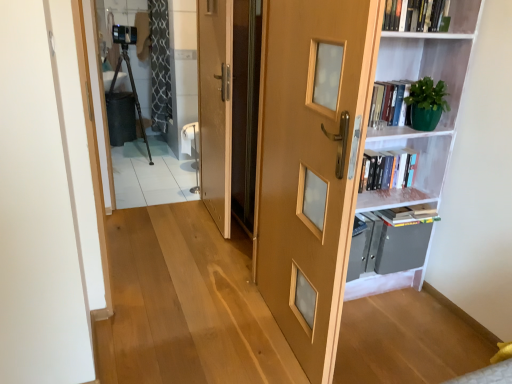
Identify the location of light brown wooden door at center, positioned as the first door in front-to-back order. The height and width of the screenshot is (384, 512). (311, 164).

The height and width of the screenshot is (384, 512). What do you see at coordinates (245, 108) in the screenshot?
I see `transparent glass screen door at center` at bounding box center [245, 108].

The height and width of the screenshot is (384, 512). Describe the element at coordinates (406, 94) in the screenshot. I see `white matte bookshelf at right` at that location.

Find the location of a particular element. The image size is (512, 384). wooden door at center, which ranks as the first door in back-to-front order is located at coordinates (215, 107).

Where is `light brown wooden door at center, which appears as the 1th door when viewed from the right`? light brown wooden door at center, which appears as the 1th door when viewed from the right is located at coordinates (311, 164).

Between light brown wooden door at center, which is the 2th door in left-to-right order, and transparent glass screen door at center, which one has less height?

Standing shorter between the two is light brown wooden door at center, which is the 2th door in left-to-right order.

Looking at this image, could you measure the distance between light brown wooden door at center, which appears as the 1th door when viewed from the right, and transparent glass screen door at center?

light brown wooden door at center, which appears as the 1th door when viewed from the right, and transparent glass screen door at center are 35.71 inches apart.

Can you confirm if light brown wooden door at center, which appears as the 1th door when viewed from the right, is smaller than transparent glass screen door at center?

No.

Is light brown wooden door at center, arranged as the second door when viewed from the back, further to the viewer compared to transparent glass screen door at center?

No, light brown wooden door at center, arranged as the second door when viewed from the back, is in front of transparent glass screen door at center.

Consider the image. Which object is positioned more to the left, transparent glass screen door at center or wooden door at center, which ranks as the first door in back-to-front order?

Positioned to the left is wooden door at center, which ranks as the first door in back-to-front order.

Would you say transparent glass screen door at center is outside wooden door at center, positioned as the 2th door in front-to-back order?

Absolutely, transparent glass screen door at center is external to wooden door at center, positioned as the 2th door in front-to-back order.

Is point (252, 57) closer or farther from the camera than point (210, 120)?

Point (252, 57) appears to be closer to the viewer than point (210, 120).

Considering the sizes of objects transparent glass screen door at center and wooden door at center, which ranks as the first door in back-to-front order, in the image provided, who is thinner, transparent glass screen door at center or wooden door at center, which ranks as the first door in back-to-front order,?

With smaller width is transparent glass screen door at center.

Is hardcover book at upper right, the first book positioned from the bottom, far from hardcover book at upper right, the 1th book positioned from the top?

hardcover book at upper right, the first book positioned from the bottom, is near hardcover book at upper right, the 1th book positioned from the top, not far away.

Would you say hardcover book at upper right, arranged as the 1th book when viewed from the back, contains hardcover book at upper right, which appears as the 2th book when viewed from the back?

Definitely not — hardcover book at upper right, which appears as the 2th book when viewed from the back, is not inside hardcover book at upper right, arranged as the 1th book when viewed from the back.

Does point (368, 170) come in front of point (416, 5)?

No.

Between hardcover book at upper right, placed as the second book when sorted from front to back, and hardcover book at upper right, the first book positioned from the front, which one has smaller width?

hardcover book at upper right, the first book positioned from the front, is thinner.

From the picture: Is light brown wooden door at center, which is the 2th door in left-to-right order, next to black textured curtain at upper left?

No, light brown wooden door at center, which is the 2th door in left-to-right order, is not with black textured curtain at upper left.

In order to click on door that is the 2nd object directly below the black textured curtain at upper left (from a real-world perspective) in this screenshot , I will do `click(311, 164)`.

Is black textured curtain at upper left a part of light brown wooden door at center, arranged as the second door when viewed from the back?

No, light brown wooden door at center, arranged as the second door when viewed from the back, does not contain black textured curtain at upper left.

Based on the photo, relative to black textured curtain at upper left, is light brown wooden door at center, arranged as the second door when viewed from the back, in front or behind?

light brown wooden door at center, arranged as the second door when viewed from the back, is in front of black textured curtain at upper left.

From the image's perspective, which one is positioned higher, hardcover book at upper right, the second book ordered from the bottom, or wooden door at center, the first door viewed from the left?

→ hardcover book at upper right, the second book ordered from the bottom, appears higher in the image.

Who is bigger, hardcover book at upper right, the second book ordered from the bottom, or wooden door at center, positioned as the 2th door in front-to-back order?

With larger size is wooden door at center, positioned as the 2th door in front-to-back order.

Does point (425, 25) come in front of point (203, 158)?

Yes, point (425, 25) is closer to viewer.

Based on the photo, can you confirm if light brown wooden door at center, arranged as the second door when viewed from the back, is shorter than white matte bookshelf at right?

Yes, light brown wooden door at center, arranged as the second door when viewed from the back, is shorter than white matte bookshelf at right.

Which of these two, light brown wooden door at center, which appears as the 1th door when viewed from the right, or white matte bookshelf at right, is thinner?

Thinner between the two is light brown wooden door at center, which appears as the 1th door when viewed from the right.

Is point (371, 15) positioned before point (384, 34)?

Yes.

From the picture: How much distance is there between black textured curtain at upper left and hardcover book at upper right, placed as the second book when sorted from front to back?

9.59 feet.

From a real-world perspective, is black textured curtain at upper left below hardcover book at upper right, arranged as the 1th book when viewed from the back?

No, from a real-world perspective, black textured curtain at upper left is not beneath hardcover book at upper right, arranged as the 1th book when viewed from the back.

Considering the sizes of objects black textured curtain at upper left and hardcover book at upper right, placed as the second book when sorted from front to back, in the image provided, who is shorter, black textured curtain at upper left or hardcover book at upper right, placed as the second book when sorted from front to back,?

hardcover book at upper right, placed as the second book when sorted from front to back, is shorter.

Can you confirm if black textured curtain at upper left is bigger than hardcover book at upper right, placed as the second book when sorted from front to back?

Yes.

This screenshot has width=512, height=384. Identify the location of the 2nd door positioned below the transparent glass screen door at center (from a real-world perspective). (311, 164).

Locate an element on the screen. The height and width of the screenshot is (384, 512). door on the left of transparent glass screen door at center is located at coordinates (215, 107).

Considering their positions, is wooden door at center, which is the second door from right to left, positioned closer to light brown wooden door at center, positioned as the first door in front-to-back order, than metallic gray cabinet at right?

metallic gray cabinet at right.

Looking at the image, which one is located closer to hardcover book at upper right, placed as the second book when sorted from front to back, clear glass door at upper left or metallic gray cabinet at right?

Based on the image, metallic gray cabinet at right appears to be nearer to hardcover book at upper right, placed as the second book when sorted from front to back.

Considering their positions, is hardcover book at upper right, placed as the second book when sorted from front to back, positioned further to black textured curtain at upper left than metallic gray cabinet at right?

metallic gray cabinet at right.

Considering their positions, is hardcover book at upper right, the first book positioned from the front, positioned closer to transparent glass screen door at center than white matte bookshelf at right?

Based on the image, white matte bookshelf at right appears to be nearer to transparent glass screen door at center.

Considering their positions, is hardcover book at upper right, which appears as the 2th book when viewed from the back, positioned further to clear glass door at upper left than black textured curtain at upper left?

hardcover book at upper right, which appears as the 2th book when viewed from the back.

Which object lies nearer to the anchor point transparent glass screen door at center, white matte bookshelf at right or hardcover book at upper right, the first book positioned from the front?

white matte bookshelf at right.

When comparing their distances from hardcover book at upper right, positioned as the second book in top-to-bottom order, does clear glass door at upper left or light brown wooden door at center, which appears as the 1th door when viewed from the right, seem closer?

light brown wooden door at center, which appears as the 1th door when viewed from the right.

Based on their spatial positions, is metallic gray cabinet at right or clear glass door at upper left closer to black textured curtain at upper left?

clear glass door at upper left is closer to black textured curtain at upper left.

What are the coordinates of `door between metallic gray cabinet at right and black textured curtain at upper left in the front-back direction` in the screenshot? It's located at (215, 107).

This screenshot has height=384, width=512. Identify the location of screen door situated between wooden door at center, which ranks as the first door in back-to-front order, and hardcover book at upper right, arranged as the 1th book when viewed from the back, from left to right. (245, 108).

Locate an element on the screen. The width and height of the screenshot is (512, 384). cabinet between hardcover book at upper right, placed as the second book when sorted from front to back, and black textured curtain at upper left, along the z-axis is located at coordinates (391, 240).

Find the location of a particular element. This screenshot has width=512, height=384. screen door situated between wooden door at center, positioned as the 2th door in front-to-back order, and white matte bookshelf at right from left to right is located at coordinates (245, 108).